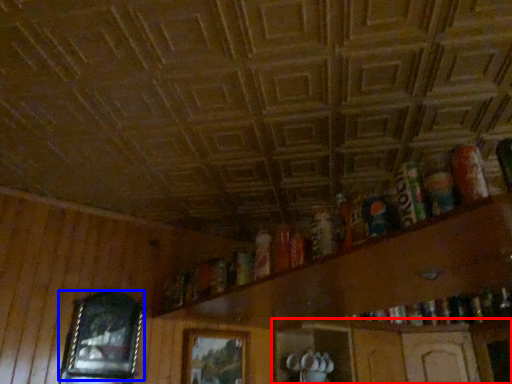
Question: Which object is closer to the camera taking this photo, shelf (highlighted by a red box) or picture frame (highlighted by a blue box)?

Choices:
 (A) shelf
 (B) picture frame

Answer: (B)